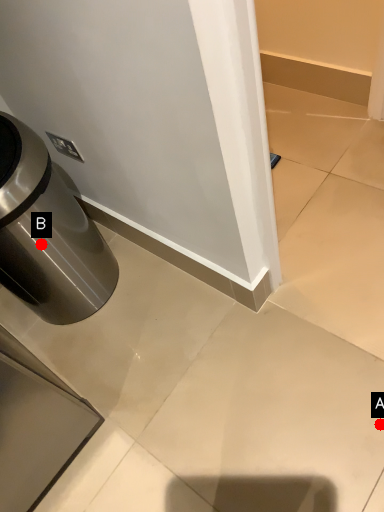
Question: Two points are circled on the image, labeled by A and B beside each circle. Which of the following is the closest to the observer?

Choices:
 (A) A is closer
 (B) B is closer

Answer: (A)